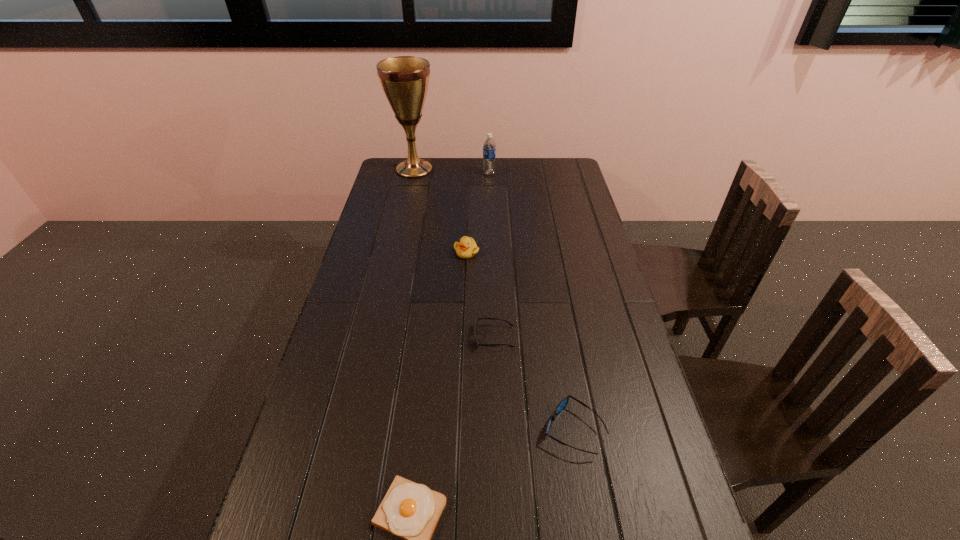
The width and height of the screenshot is (960, 540). In order to click on object that is at the right edge in this screenshot , I will do `click(564, 402)`.

Where is `object present at the far left corner`? The width and height of the screenshot is (960, 540). object present at the far left corner is located at coordinates (405, 79).

Where is `free spot at the far edge of the desktop`? This screenshot has width=960, height=540. free spot at the far edge of the desktop is located at coordinates (438, 158).

In the image, there is a desktop. Where is `vacant region at the left edge`? Image resolution: width=960 pixels, height=540 pixels. vacant region at the left edge is located at coordinates (384, 264).

The image size is (960, 540). In the image, there is a desktop. What are the coordinates of `vacant area at the right edge` in the screenshot? It's located at (585, 361).

The width and height of the screenshot is (960, 540). What are the coordinates of `free space at the far right corner of the desktop` in the screenshot? It's located at (554, 159).

Identify the location of free area in between the right sunglasses and the third tallest object. (520, 341).

The width and height of the screenshot is (960, 540). Find the location of `vacant space that is in between the third farthest object and the fifth shortest object`. vacant space that is in between the third farthest object and the fifth shortest object is located at coordinates (478, 213).

Image resolution: width=960 pixels, height=540 pixels. I want to click on free space between the tallest object and the third farthest object, so click(x=441, y=211).

This screenshot has width=960, height=540. What are the coordinates of `empty space between the third tallest object and the shorter sunglasses` in the screenshot? It's located at (480, 294).